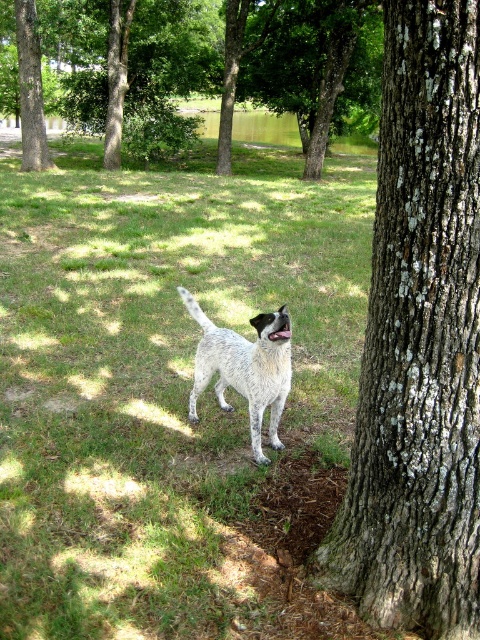
Question: Is green grass at center thinner than speckled fur dog at center?

Choices:
 (A) no
 (B) yes

Answer: (A)

Question: Which point is farther to the camera?

Choices:
 (A) green bark tree at upper center
 (B) speckled fur dog at center
 (C) green grass at center
 (D) brown rough tree at upper left

Answer: (A)

Question: Where is green bark tree at upper center located in relation to brown rough tree at upper left in the image?

Choices:
 (A) right
 (B) left

Answer: (A)

Question: Which of the following is the closest to the observer?

Choices:
 (A) (97, 221)
 (B) (434, 188)
 (C) (257, 435)
 (D) (201, 49)

Answer: (B)

Question: Does speckled fur dog at center appear under brown rough tree at upper left?

Choices:
 (A) no
 (B) yes

Answer: (B)

Question: Considering the real-world distances, which object is closest to the speckled fur dog at center?

Choices:
 (A) green bark tree at upper center
 (B) green grass at center
 (C) grayish-brown bark tree trunk at right

Answer: (C)